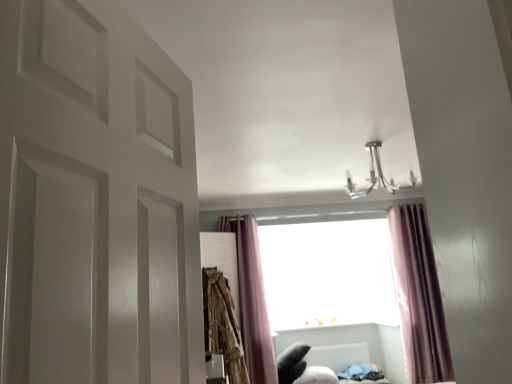
Question: Should I look upward or downward to see white plastic radiator at lower center?

Choices:
 (A) down
 (B) up

Answer: (A)

Question: Is white matte door at left wider than purple velvet curtain at center, the 2th curtain viewed from the left?

Choices:
 (A) no
 (B) yes

Answer: (A)

Question: From a real-world perspective, is white matte door at left positioned over purple velvet curtain at center, the 2th curtain viewed from the left, based on gravity?

Choices:
 (A) no
 (B) yes

Answer: (B)

Question: Does white matte door at left appear on the right side of purple velvet curtain at center, the 1th curtain in the right-to-left sequence?

Choices:
 (A) no
 (B) yes

Answer: (A)

Question: Can you confirm if white matte door at left is smaller than purple velvet curtain at center, the 2th curtain viewed from the left?

Choices:
 (A) yes
 (B) no

Answer: (A)

Question: Is white matte door at left closer to camera compared to purple velvet curtain at center, the 2th curtain viewed from the left?

Choices:
 (A) yes
 (B) no

Answer: (A)

Question: Is white matte door at left turned away from purple velvet curtain at center, the 1th curtain in the right-to-left sequence?

Choices:
 (A) no
 (B) yes

Answer: (A)

Question: Does purple velvet curtain at center, the 2th curtain viewed from the left, turn towards white matte door at left?

Choices:
 (A) yes
 (B) no

Answer: (B)

Question: Would you say purple velvet curtain at center, the 1th curtain in the right-to-left sequence, is outside white matte door at left?

Choices:
 (A) no
 (B) yes

Answer: (B)

Question: Is purple velvet curtain at center, the 2th curtain viewed from the left, taller than white matte door at left?

Choices:
 (A) yes
 (B) no

Answer: (A)

Question: Would you say purple velvet curtain at center, the 2th curtain viewed from the left, contains white matte door at left?

Choices:
 (A) yes
 (B) no

Answer: (B)

Question: Considering the relative sizes of purple velvet curtain at center, the 1th curtain in the right-to-left sequence, and white matte door at left in the image provided, is purple velvet curtain at center, the 1th curtain in the right-to-left sequence, bigger than white matte door at left?

Choices:
 (A) yes
 (B) no

Answer: (A)

Question: Does purple velvet curtain at center, the 1th curtain in the right-to-left sequence, appear on the left side of white matte door at left?

Choices:
 (A) no
 (B) yes

Answer: (A)

Question: From the image's perspective, is purple velvet curtain at center, the 2th curtain viewed from the left, on top of purple velvet curtain at center, positioned as the second curtain in right-to-left order?

Choices:
 (A) yes
 (B) no

Answer: (A)